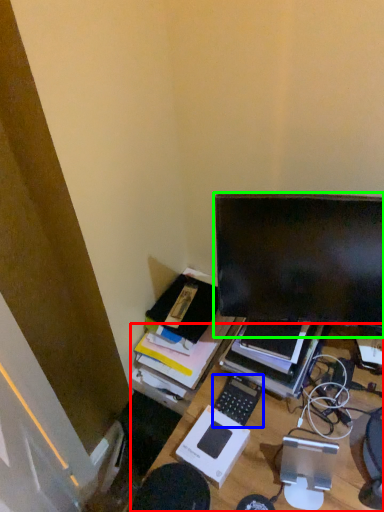
Question: Which object is positioned farthest from desk (highlighted by a red box)? Select from computer keyboard (highlighted by a blue box) and computer monitor (highlighted by a green box).

Choices:
 (A) computer keyboard
 (B) computer monitor

Answer: (B)